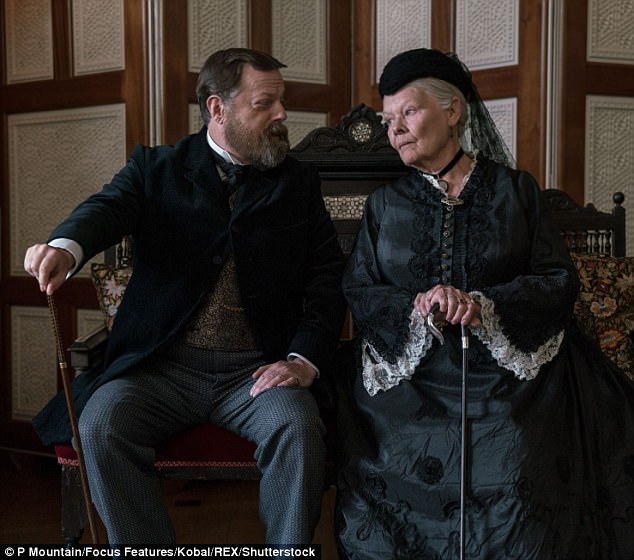
Image resolution: width=634 pixels, height=560 pixels. Find the location of `floor`. floor is located at coordinates (220, 517).